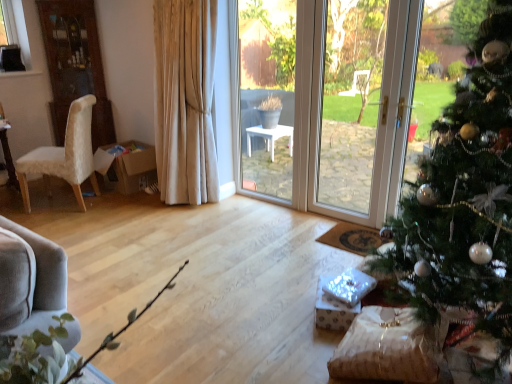
Question: Is white plush chair at left taller than green matte christmas tree at right?

Choices:
 (A) no
 (B) yes

Answer: (A)

Question: Is white plush chair at left closer to camera compared to green matte christmas tree at right?

Choices:
 (A) yes
 (B) no

Answer: (B)

Question: Is white plush chair at left wider than green matte christmas tree at right?

Choices:
 (A) yes
 (B) no

Answer: (B)

Question: Can you confirm if white plush chair at left is smaller than green matte christmas tree at right?

Choices:
 (A) no
 (B) yes

Answer: (B)

Question: Could you tell me if white plush chair at left is turned towards green matte christmas tree at right?

Choices:
 (A) no
 (B) yes

Answer: (A)

Question: Is white plush chair at left at the left side of green matte christmas tree at right?

Choices:
 (A) yes
 (B) no

Answer: (A)

Question: From the image's perspective, is green matte christmas tree at right over white plush chair at left?

Choices:
 (A) yes
 (B) no

Answer: (B)

Question: Does green matte christmas tree at right appear on the right side of white plush chair at left?

Choices:
 (A) no
 (B) yes

Answer: (B)

Question: Is green matte christmas tree at right wider than white plush chair at left?

Choices:
 (A) no
 (B) yes

Answer: (B)

Question: From a real-world perspective, is green matte christmas tree at right on top of white plush chair at left?

Choices:
 (A) no
 (B) yes

Answer: (B)

Question: Does green matte christmas tree at right touch white plush chair at left?

Choices:
 (A) no
 (B) yes

Answer: (A)

Question: Is green matte christmas tree at right looking in the opposite direction of white plush chair at left?

Choices:
 (A) yes
 (B) no

Answer: (B)

Question: Is white plush chair at left to the left or to the right of green matte christmas tree at right in the image?

Choices:
 (A) left
 (B) right

Answer: (A)